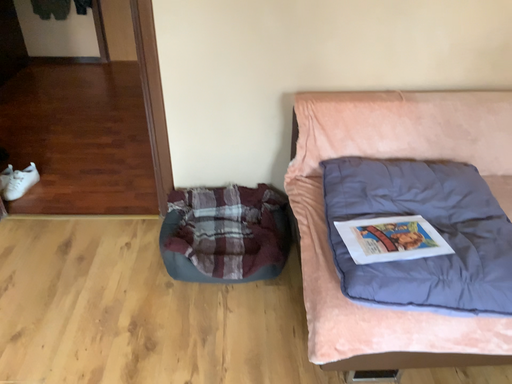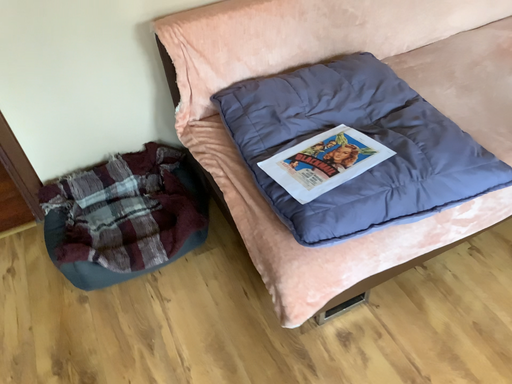
Question: Which way did the camera rotate in the video?

Choices:
 (A) rotated right
 (B) rotated left

Answer: (A)